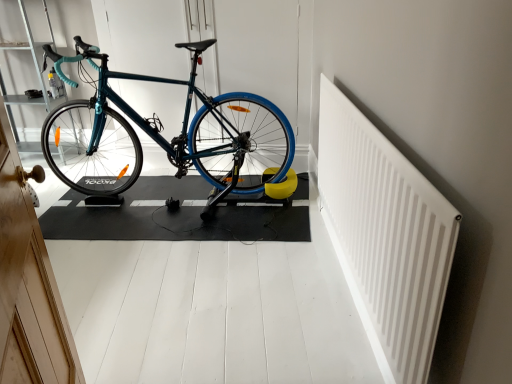
Identify the location of free spot below white plastic radiator at upper right (from a real-world perspective). (349, 290).